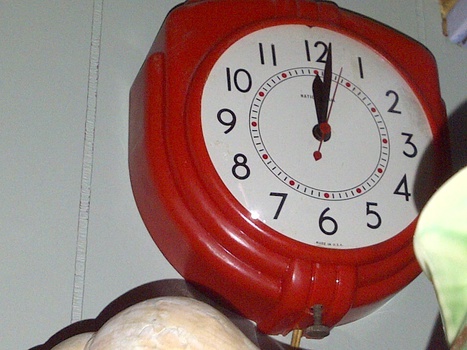
Image resolution: width=467 pixels, height=350 pixels. I want to click on clock, so click(349, 163).